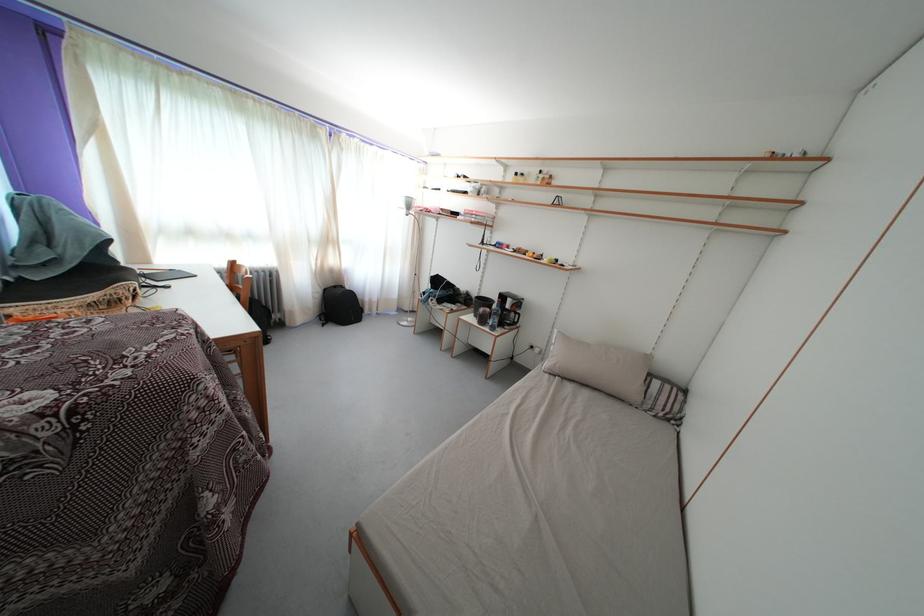
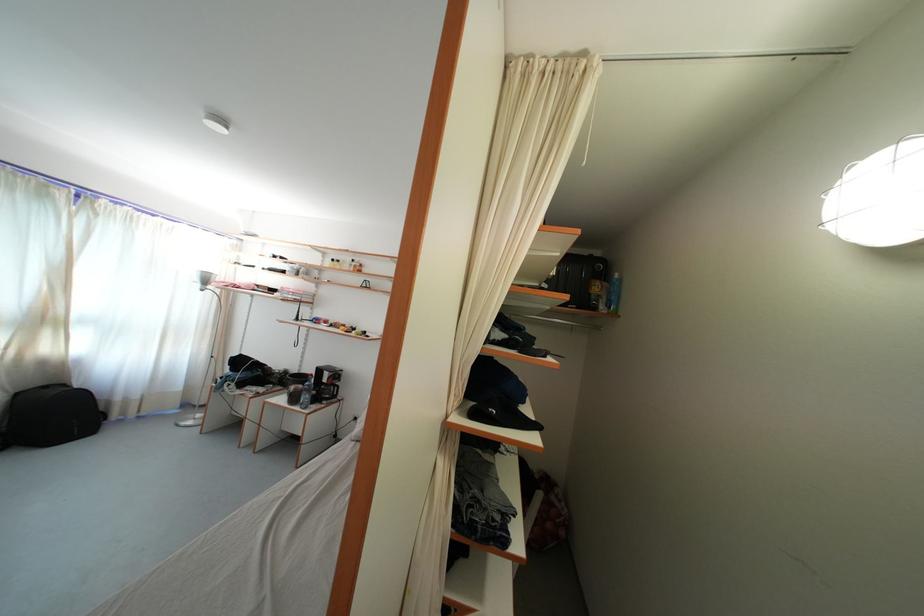
In the second image, find the point that corresponds to point (335, 246) in the first image.

(52, 326)